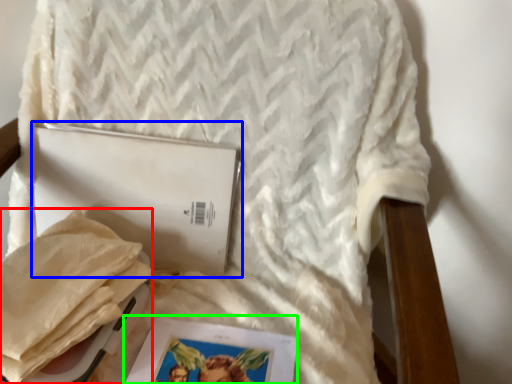
Question: Based on their relative distances, which object is farther from material (highlighted by a red box)? Choose from journal (highlighted by a blue box) and magazine (highlighted by a green box).

Choices:
 (A) journal
 (B) magazine

Answer: (B)